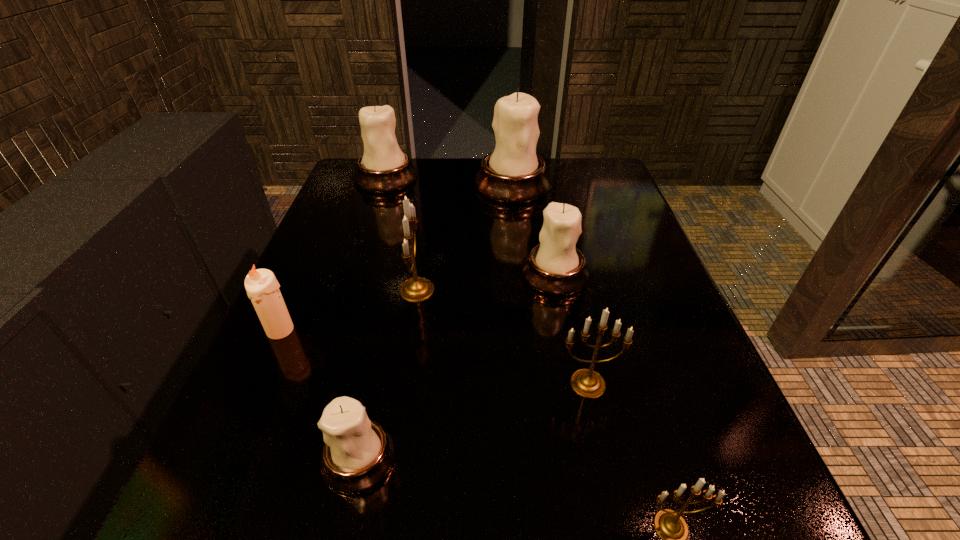
At what (x,y) coordinates should I click in order to perform the action: click on gold candelabrum that is the third closest one to the sixth farthest candelabrum. Please return your answer as a coordinate pair (x, y). Image resolution: width=960 pixels, height=540 pixels. Looking at the image, I should click on (669, 524).

The height and width of the screenshot is (540, 960). In order to click on free region that satisfies the following two spatial constraints: 1. on the front side of the third biggest white candle holder; 2. on the right side of the third smallest white candle holder in this screenshot , I will do `click(354, 274)`.